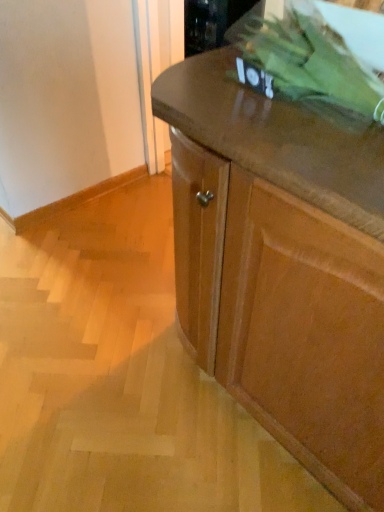
Identify the location of vacant region to the left of wooden cabinet at center. (100, 362).